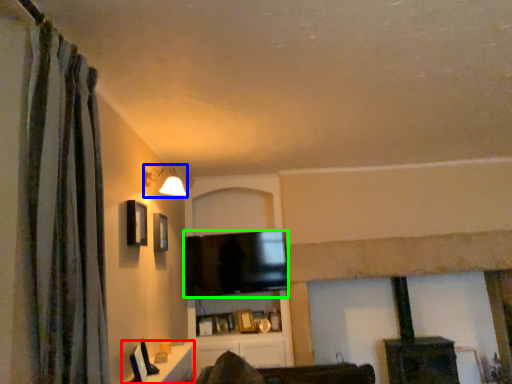
Question: Based on their relative distances, which object is farther from table (highlighted by a red box)? Choose from light fixture (highlighted by a blue box) and television (highlighted by a green box).

Choices:
 (A) light fixture
 (B) television

Answer: (A)